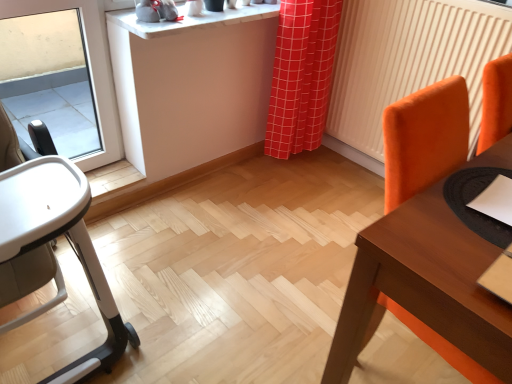
Image resolution: width=512 pixels, height=384 pixels. I want to click on vacant area that lies to the right of beige fabric highchair at left, so click(202, 299).